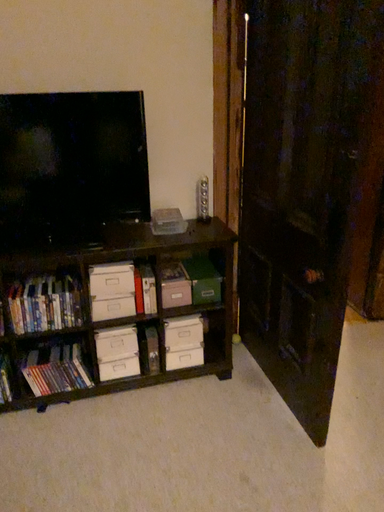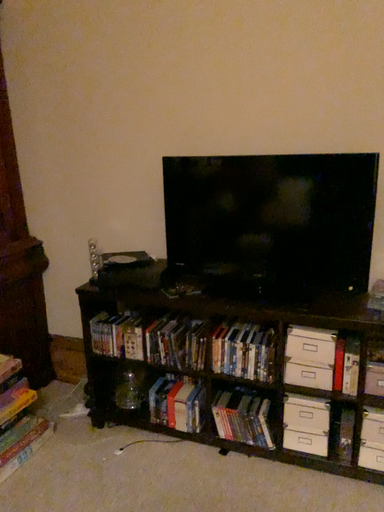
Question: Which way did the camera rotate in the video?

Choices:
 (A) rotated right
 (B) rotated left

Answer: (B)